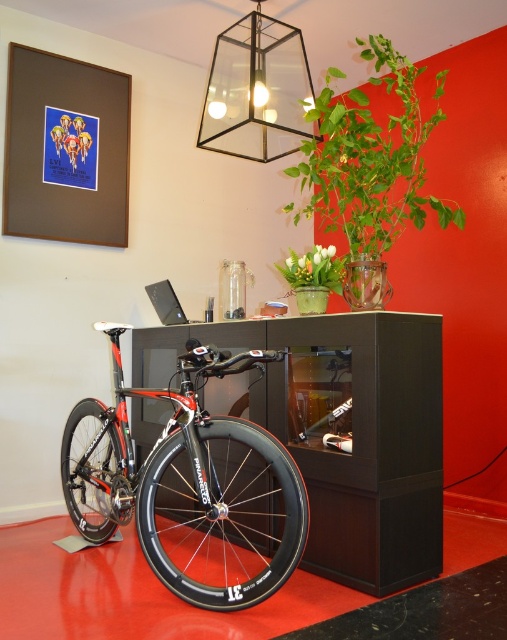
You are organizing a display in the room and need to place a new item between the black carbon fiber wheel at center and the green leafy plant at upper right. Where should you position it to maintain symmetry?

To maintain symmetry, position the new item between the black carbon fiber wheel at center and the green leafy plant at upper right, aligning it along the central axis between them.

You are standing in the room and see the point at coordinates (x=223, y=516). What object is this point located on?

The point at coordinates (x=223, y=516) is located on the black carbon fiber wheel at center.